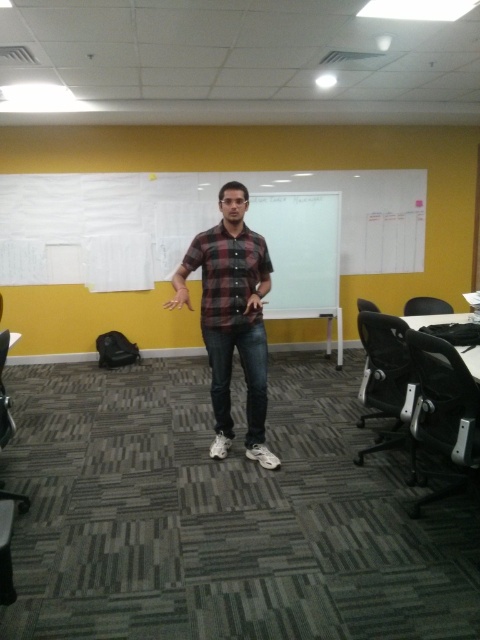
Question: In this image, where is plaid shirt at center located relative to plaid cotton shirt at center?

Choices:
 (A) right
 (B) left

Answer: (B)

Question: Is plaid shirt at center smaller than plaid cotton shirt at center?

Choices:
 (A) no
 (B) yes

Answer: (A)

Question: Is plaid shirt at center to the right of plaid cotton shirt at center from the viewer's perspective?

Choices:
 (A) yes
 (B) no

Answer: (B)

Question: Among these points, which one is farthest from the camera?

Choices:
 (A) (261, 422)
 (B) (228, 243)

Answer: (A)